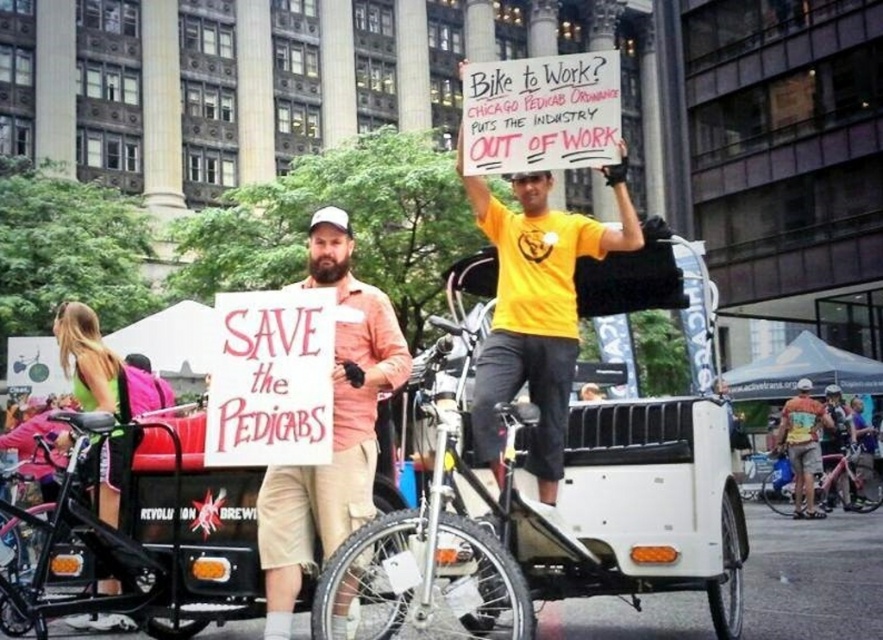
You are a photographer at the protest scene. You need to take a photo of both the beige cotton shorts at center and the metallic silver camera at center. Since you want to ensure both objects are in focus, you need to know their relative sizes. Which object is wider?

The beige cotton shorts at center is wider than the metallic silver camera at center.